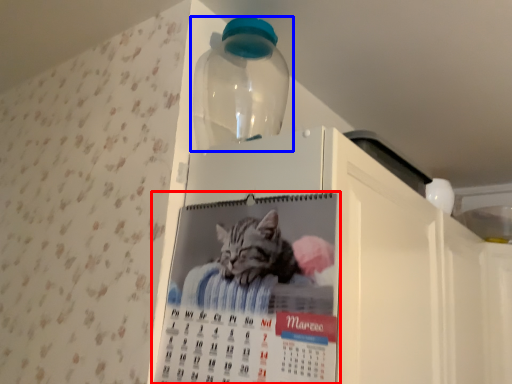
Question: Which object appears farthest to the camera in this image, poster (highlighted by a red box) or bottle (highlighted by a blue box)?

Choices:
 (A) poster
 (B) bottle

Answer: (B)